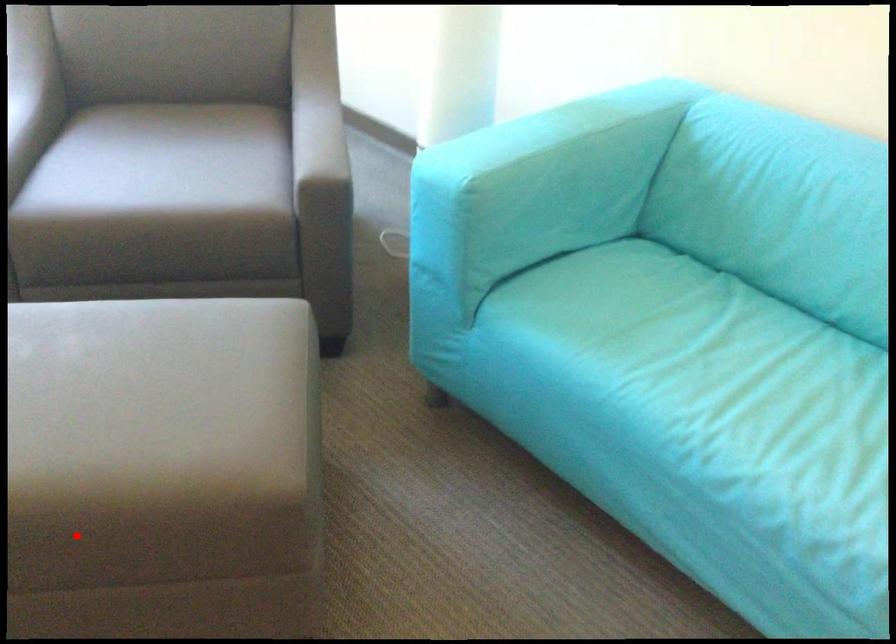
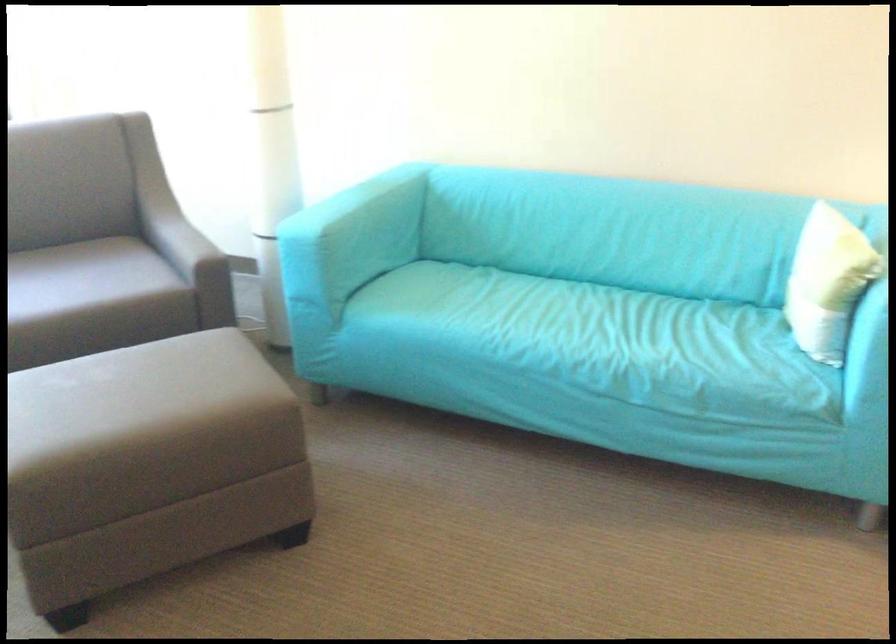
Question: I am providing you with two images of the same scene from different viewpoints. Image1 has a red point marked. In image2, the corresponding 3D location appears at what relative position? Reply with the corresponding letter.

Choices:
 (A) Closer
 (B) Farther

Answer: (B)